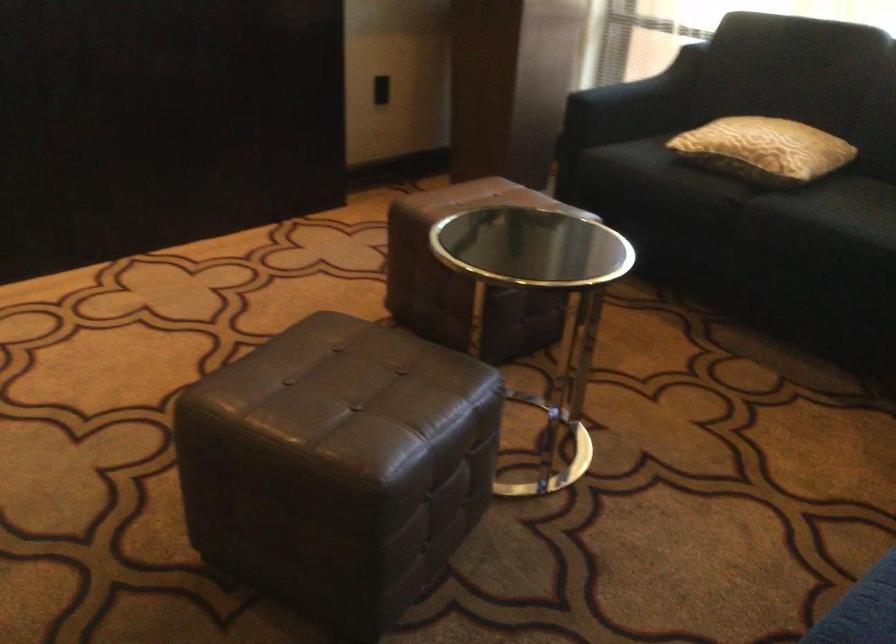
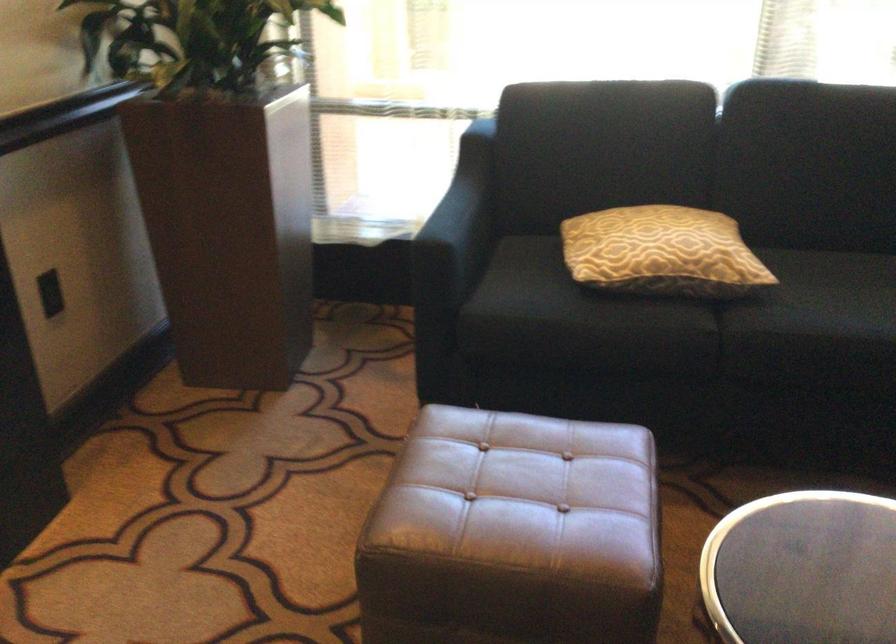
The point at (738, 138) is marked in the first image. Where is the corresponding point in the second image?

(661, 252)